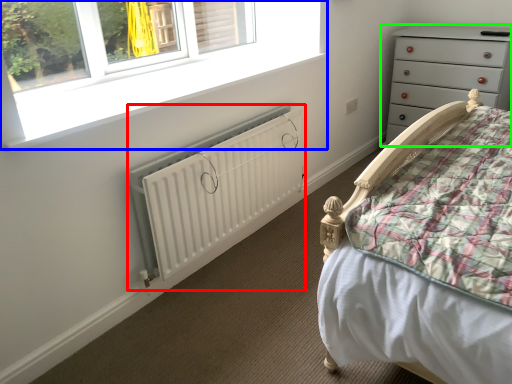
Question: Which object is the closest to the radiator (highlighted by a red box)? Choose among these: window (highlighted by a blue box) or chest of drawers (highlighted by a green box).

Choices:
 (A) window
 (B) chest of drawers

Answer: (A)